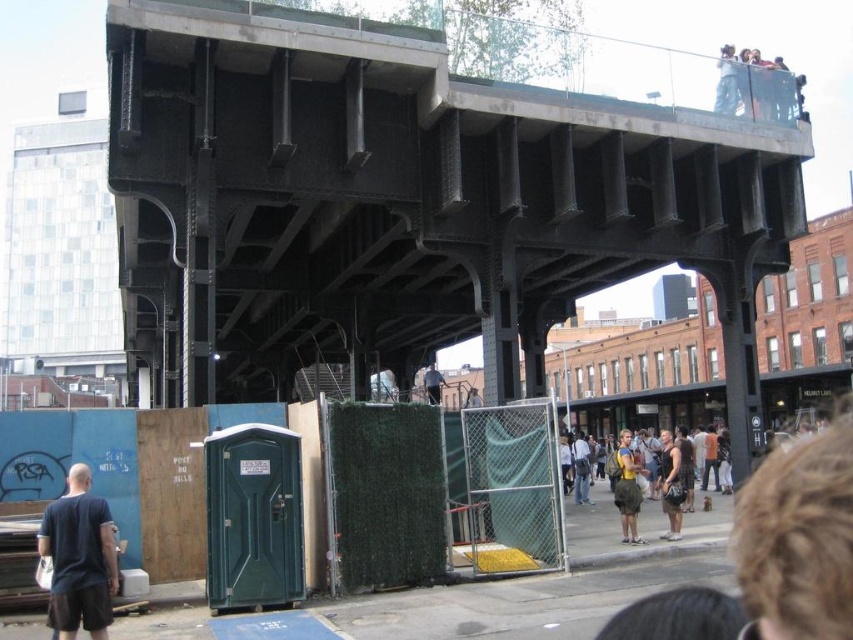
You are standing at point (54, 506) and want to walk to the elevated structure. Is the point (407, 93) blocking your path?

Point (407, 93) is behind point (54, 506), so it is not blocking your path to the elevated structure.

You are a photographer standing at the camera position in the scene. You want to capture a photo of the black steel bridge at upper center. Given that your camera has a maximum zoom range of 25 meters, will you be able to clearly photograph the bridge without moving closer?

The black steel bridge at upper center and camera are 27.18 meters apart from each other. Since the camera can only zoom up to 25 meters, you will not be able to clearly photograph the bridge without moving closer.